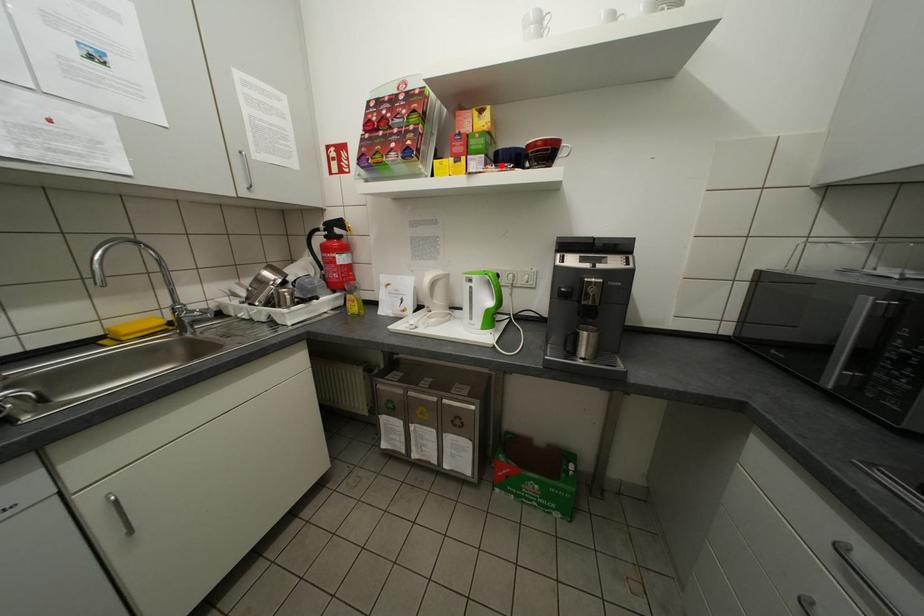
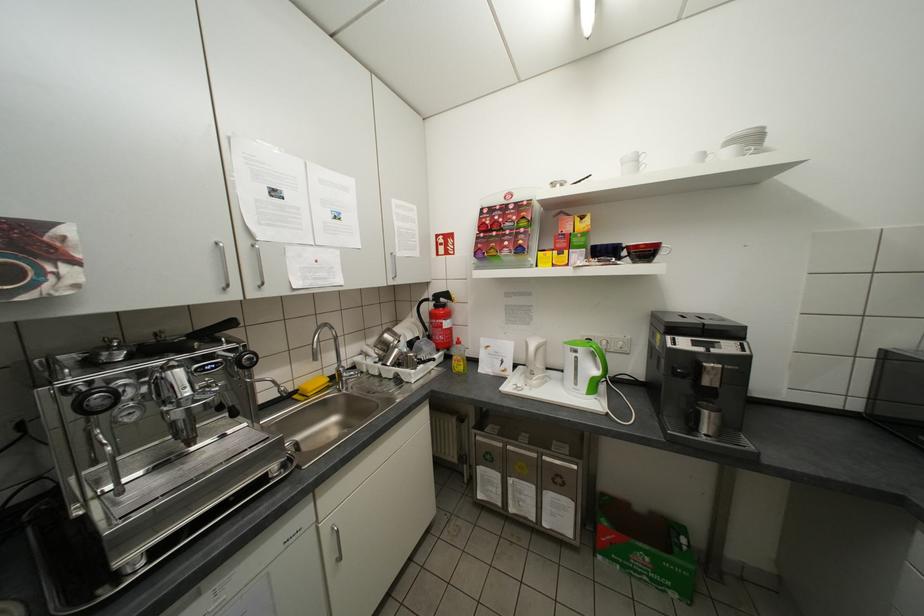
Locate, in the second image, the point that corresponds to the highlighted location in the first image.

(603, 259)